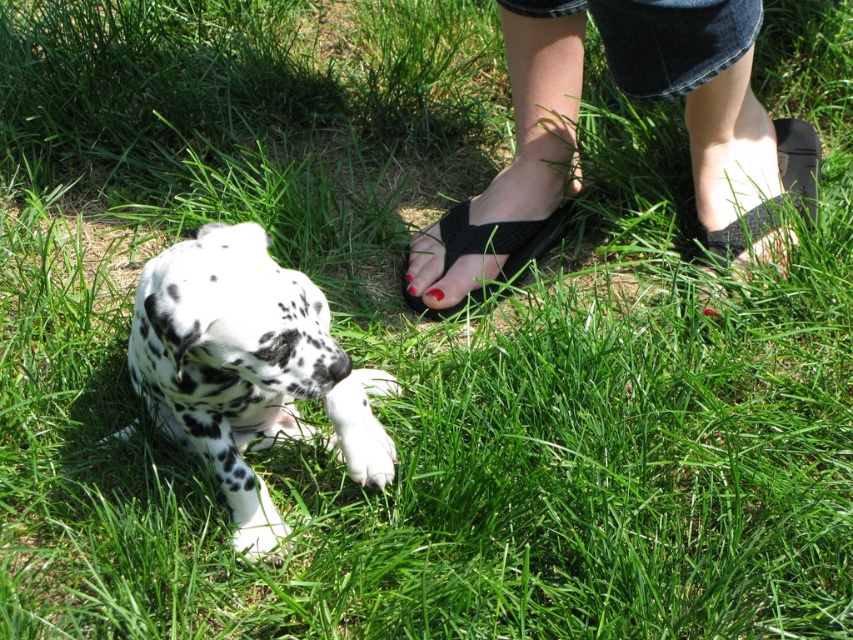
You are a dog trainer observing the scene. The Dalmatian puppy is lying on the grass, and you notice the black fabric sandals at lower right and the matte red nail polish at center. Which object is closer to the puppy?

The matte red nail polish at center is closer to the puppy because it is only 26.59 inches away from the black fabric sandals at lower right, but the question is about proximity to the puppy. Wait, the description says the distance between the two objects is 26.59 inches, but we need to determine which is closer to the puppy. However, the scene description mentions the person is near the puppy, and the sandals are at lower right while the nail polish is at center. Assuming the puppy is at the center area,

You are a photographer trying to capture a closeup of the nail polish at center. You notice the black fabric sandals at lower right might block your view. Based on their sizes, will the sandals block the nail polish?

The black fabric sandals at lower right is taller than nail polish at center, so the sandals will block the nail polish.